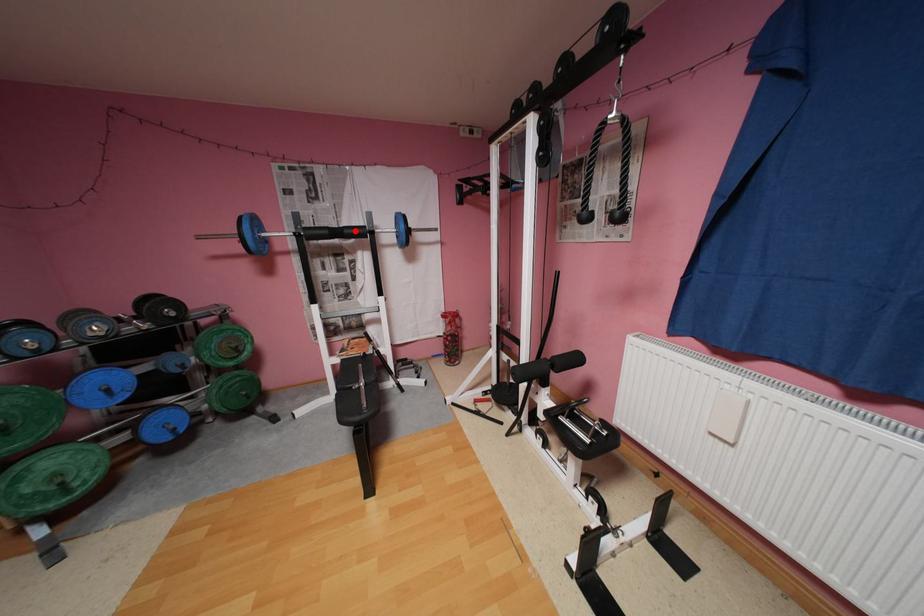
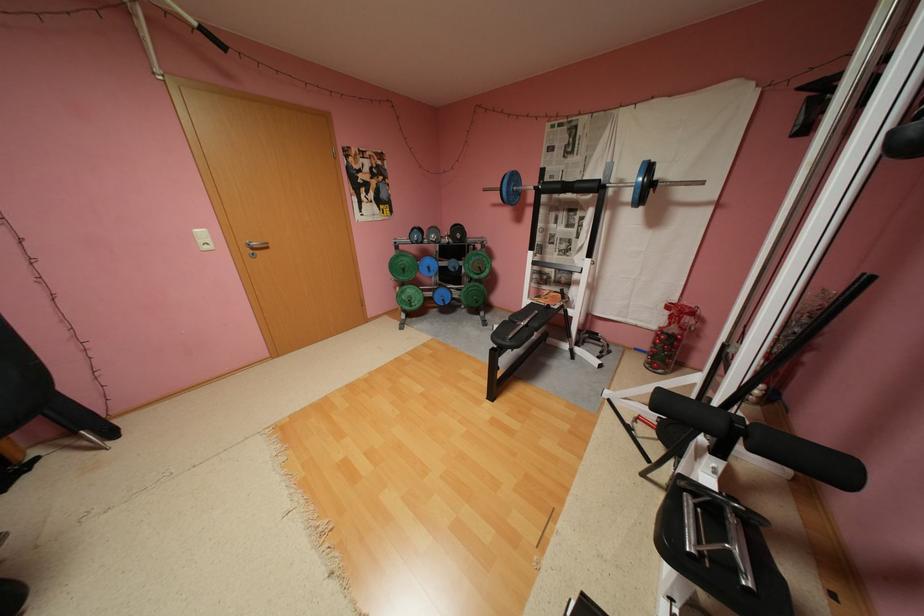
Question: I am providing you with two images of the same scene from different viewpoints. Given a red point in image1, look at the same physical point in image2. Is it:

Choices:
 (A) Closer to the viewpoint
 (B) Farther from the viewpoint

Answer: (A)